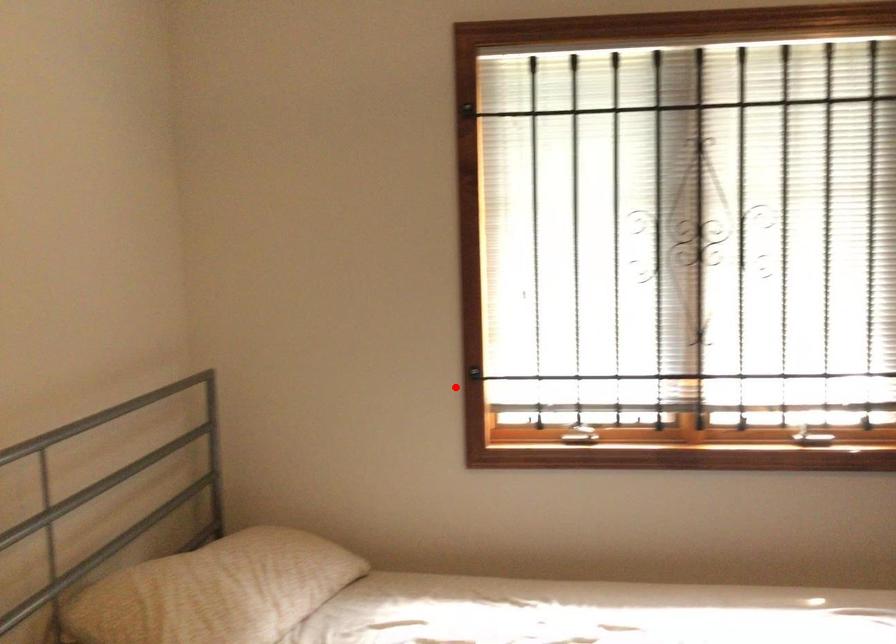
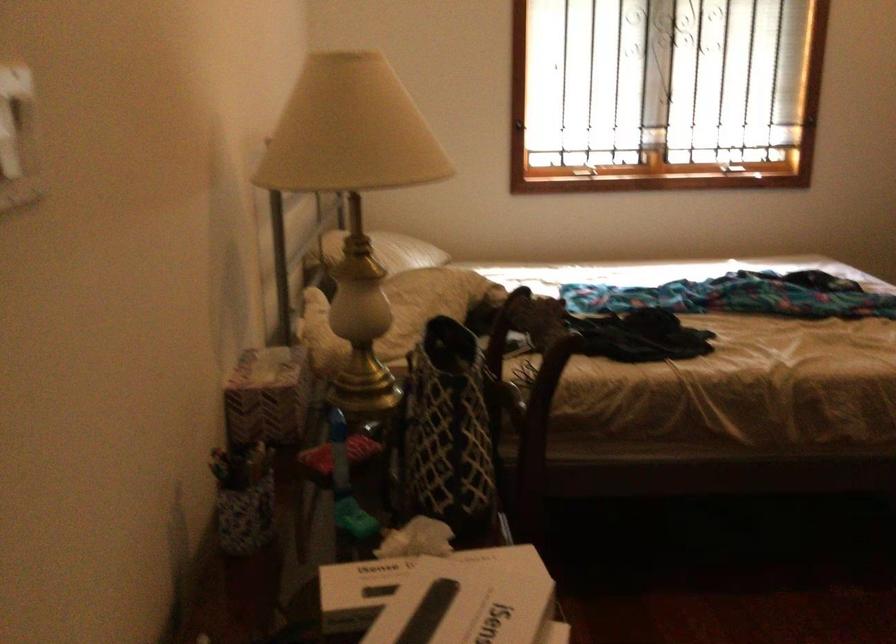
In the second image, find the point that corresponds to the highlighted location in the first image.

(520, 124)